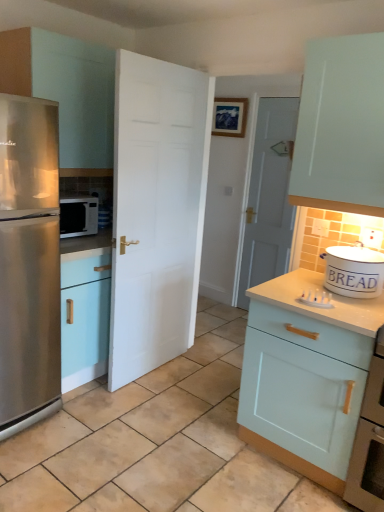
Locate an element on the screen. This screenshot has height=512, width=384. free space that is in between white matte door at center, positioned as the 1th door in left-to-right order, and light blue wood cabinet at right, marked as the 2th cabinetry in a top-to-bottom arrangement is located at coordinates (192, 401).